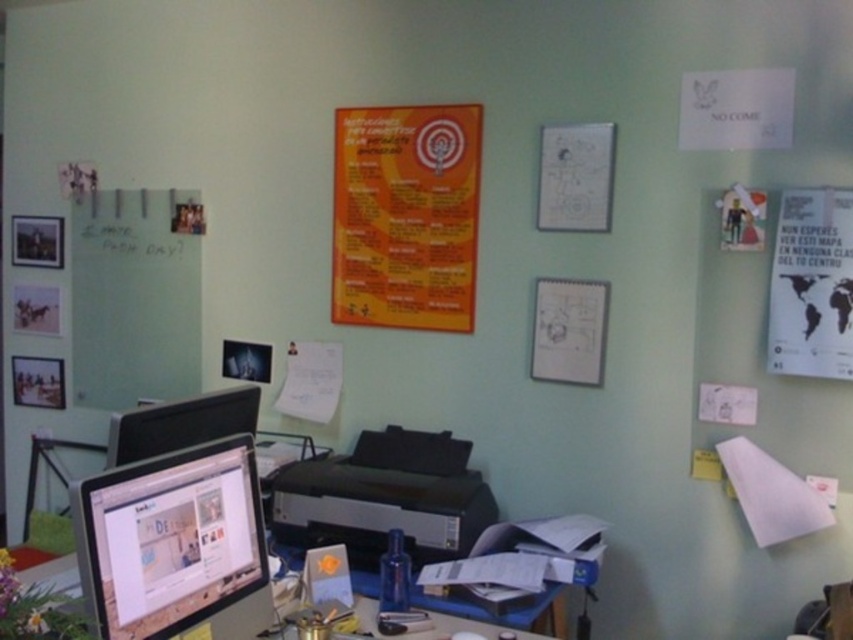
Is point (418, 125) farther from camera compared to point (138, 298)?

That is False.

What do you see at coordinates (405, 216) in the screenshot?
I see `orange paper poster at upper center` at bounding box center [405, 216].

Is point (450, 240) more distant than point (115, 410)?

No.

Where is `orange paper poster at upper center`? This screenshot has height=640, width=853. orange paper poster at upper center is located at coordinates (405, 216).

Who is taller, satin black monitor at lower left or matte black monitor at lower left?

satin black monitor at lower left is taller.

Who is positioned more to the left, satin black monitor at lower left or matte black monitor at lower left?

From the viewer's perspective, matte black monitor at lower left appears more on the left side.

Identify the location of satin black monitor at lower left. This screenshot has height=640, width=853. (175, 545).

Image resolution: width=853 pixels, height=640 pixels. What are the coordinates of `satin black monitor at lower left` in the screenshot? It's located at (175, 545).

Can you confirm if white paper map at right is shorter than white paper drawing at upper center?

No.

What do you see at coordinates (811, 285) in the screenshot?
I see `white paper map at right` at bounding box center [811, 285].

Find the location of a particular element. The image size is (853, 640). white paper map at right is located at coordinates (811, 285).